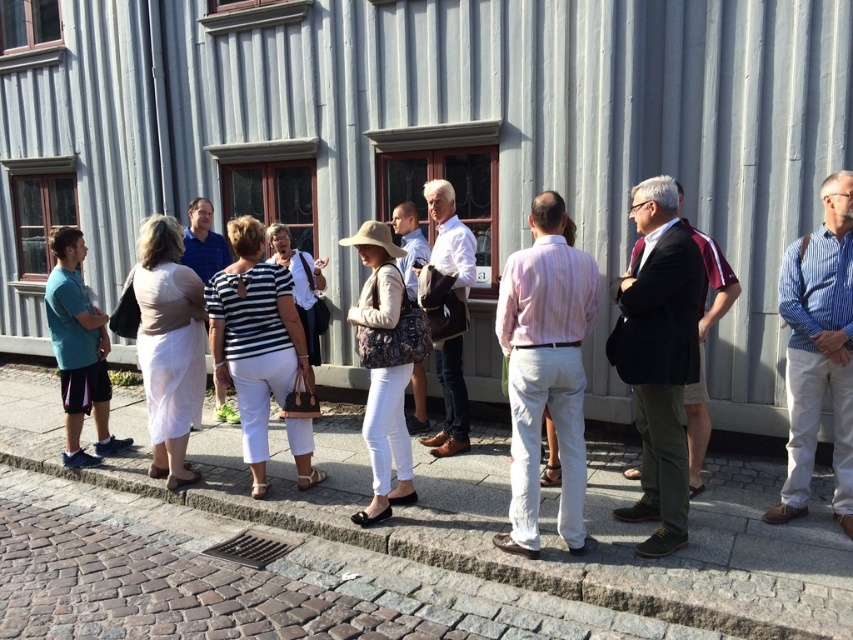
Question: Is dark gray suit at center above striped fabric shirt at center?

Choices:
 (A) no
 (B) yes

Answer: (A)

Question: Among these points, which one is nearest to the camera?

Choices:
 (A) (140, 250)
 (B) (384, 250)

Answer: (B)

Question: Which point is closer to the camera?

Choices:
 (A) blue striped shirt at right
 (B) teal fabric shorts at left

Answer: (A)

Question: Does gray concrete curb at lower center have a lesser width compared to striped cotton shirt at center?

Choices:
 (A) yes
 (B) no

Answer: (B)

Question: Does striped cotton shirt at center appear over patterned fabric hat at center?

Choices:
 (A) no
 (B) yes

Answer: (B)

Question: Which of the following is the farthest from the observer?

Choices:
 (A) [x=309, y=372]
 (B) [x=659, y=332]
 (C) [x=77, y=426]

Answer: (C)